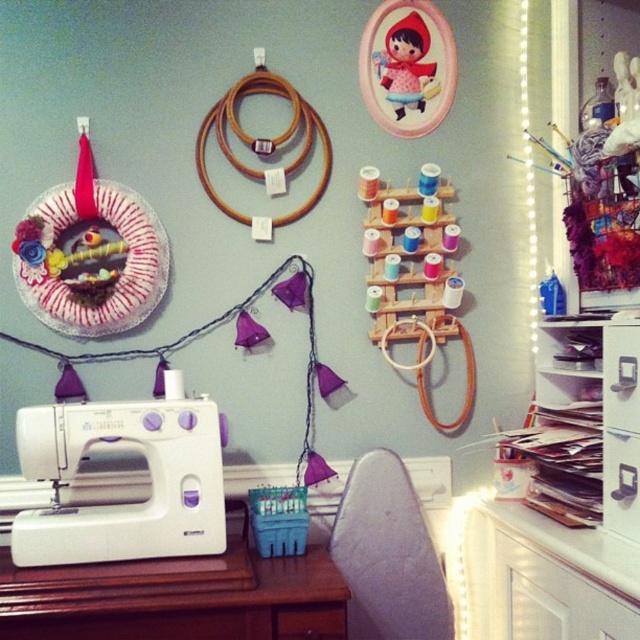
Consider the image. You are organizing a craft fair and need to place a small decorative item between the white glossy dresser at right and the matte pink fabric doll at upper center. Based on their positions, where should you place the item?

The white glossy dresser at right is below the matte pink fabric doll at upper center, so you should place the item between them vertically. Since the dresser is lower, position the item above the dresser but below the doll to maintain the vertical alignment.

You are organizing a craft fair and need to place a decorative item on the white glossy dresser at right and the matte wood drawer at lower center. Which surface is on the right side?

The white glossy dresser at right is positioned on the right side of the matte wood drawer at lower center, so the white glossy dresser at right is on the right side.

You are standing in the sewing room and want to place a new sewing kit on the white wood table at lower left. Based on the coordinates provided, is the point at (177, 598) the correct location for the table?

Yes, the point at (177, 598) corresponds to the white wood table at lower left, so placing the sewing kit there would be correct.